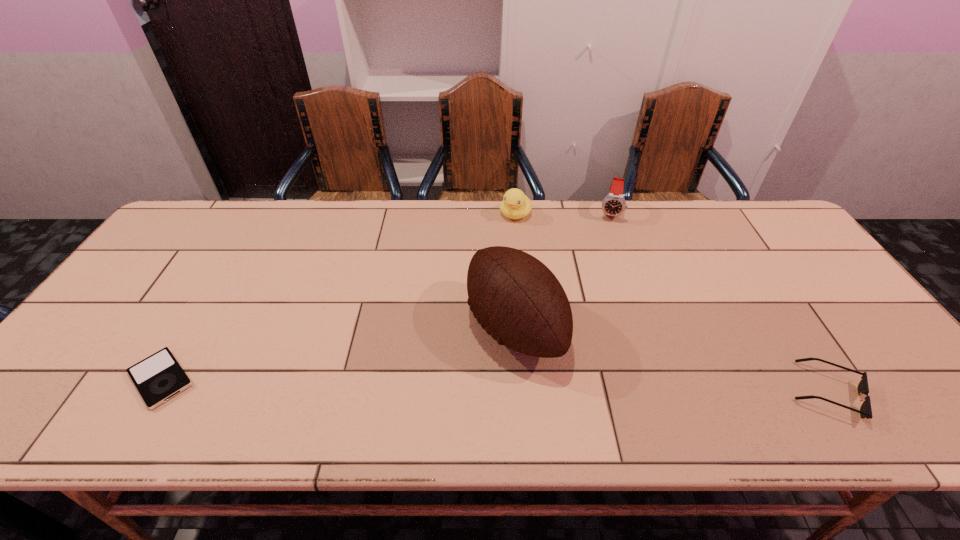
Locate an element on the screen. The height and width of the screenshot is (540, 960). iPod present at the near edge is located at coordinates (159, 377).

Locate an element on the screen. sunglasses positioned at the near edge is located at coordinates (865, 411).

Where is `football located at the near edge`? The width and height of the screenshot is (960, 540). football located at the near edge is located at coordinates (516, 298).

What are the coordinates of `object positioned at the right edge` in the screenshot? It's located at (865, 411).

Locate an element on the screen. The width and height of the screenshot is (960, 540). object positioned at the near right corner is located at coordinates (865, 411).

Find the location of a particular element. vacant space at the far edge of the desktop is located at coordinates (662, 228).

Locate an element on the screen. Image resolution: width=960 pixels, height=540 pixels. vacant space at the near edge of the desktop is located at coordinates [720, 374].

Locate an element on the screen. free space at the left edge of the desktop is located at coordinates (79, 355).

Identify the location of free point at the right edge. (872, 346).

What are the coordinates of `vacant point located between the shortest object and the fourth object from left to right` in the screenshot? It's located at (385, 295).